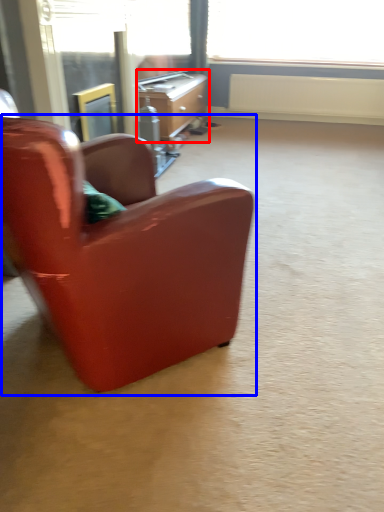
Question: Which object is closer to the camera taking this photo, desk (highlighted by a red box) or chair (highlighted by a blue box)?

Choices:
 (A) desk
 (B) chair

Answer: (B)